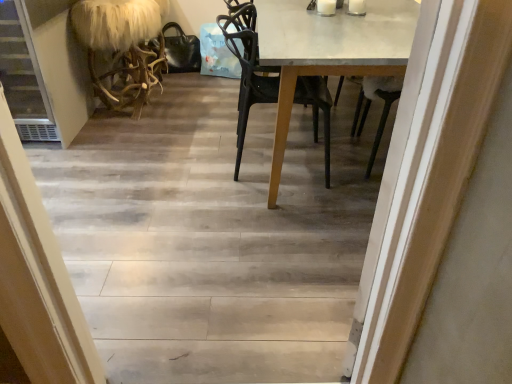
Image resolution: width=512 pixels, height=384 pixels. What are the coordinates of `free space to the right of black matte chair at center` in the screenshot? It's located at click(346, 157).